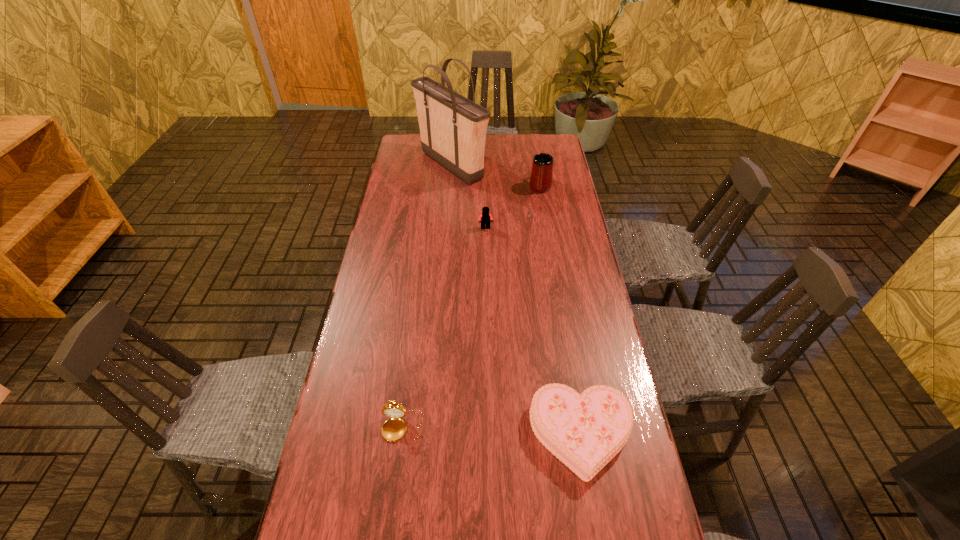
The image size is (960, 540). I want to click on free space at the right edge of the desktop, so click(x=607, y=337).

Where is `blank region between the pocket watch and the cake`? Image resolution: width=960 pixels, height=540 pixels. blank region between the pocket watch and the cake is located at coordinates (492, 430).

Find the location of a particular element. free area in between the third farthest object and the pocket watch is located at coordinates (444, 327).

Locate an element on the screen. blank region between the shopping bag and the cake is located at coordinates (516, 300).

Where is `vacant space in between the shortest object and the pocket watch`? vacant space in between the shortest object and the pocket watch is located at coordinates (492, 430).

The height and width of the screenshot is (540, 960). Identify the location of vacant space in between the mug and the pocket watch. (471, 306).

The image size is (960, 540). Identify the location of unoccupied position between the mug and the tallest object. (496, 176).

Image resolution: width=960 pixels, height=540 pixels. In order to click on free space between the pocket watch and the second tallest object in this screenshot , I will do `click(471, 306)`.

I want to click on free spot between the pocket watch and the tallest object, so click(427, 296).

At what (x,y) coordinates should I click in order to perform the action: click on free point between the tallest object and the third nearest object. Please return your answer as a coordinate pair (x, y). Looking at the image, I should click on click(x=468, y=197).